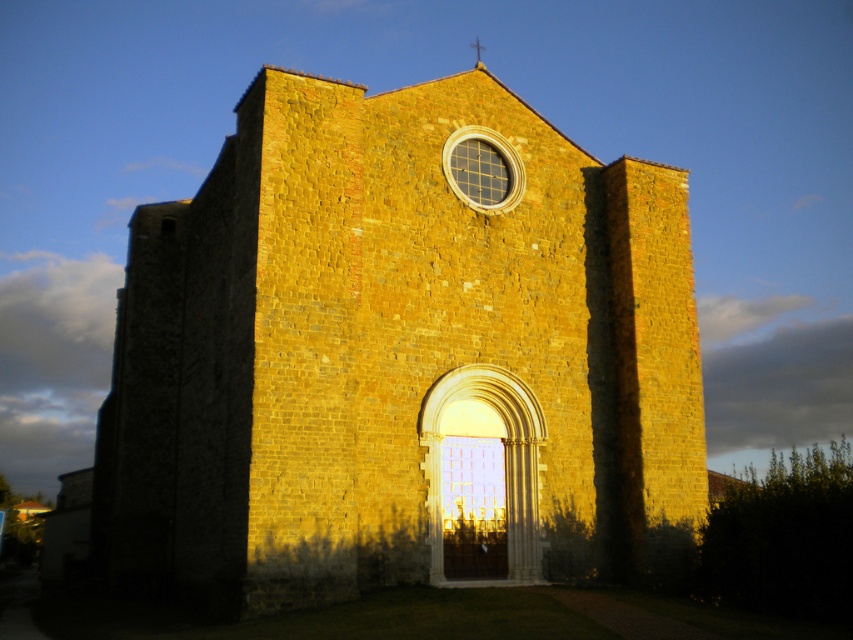
Question: Does yellow stone church at center appear over metallic cross at upper center?

Choices:
 (A) yes
 (B) no

Answer: (B)

Question: Among these objects, which one is nearest to the camera?

Choices:
 (A) metallic cross at upper center
 (B) yellow stone church at center

Answer: (B)

Question: Among these points, which one is nearest to the camera?

Choices:
 (A) (256, 554)
 (B) (476, 52)

Answer: (A)

Question: Does yellow stone church at center come in front of metallic cross at upper center?

Choices:
 (A) yes
 (B) no

Answer: (A)

Question: Can you confirm if yellow stone church at center is positioned to the left of metallic cross at upper center?

Choices:
 (A) no
 (B) yes

Answer: (B)